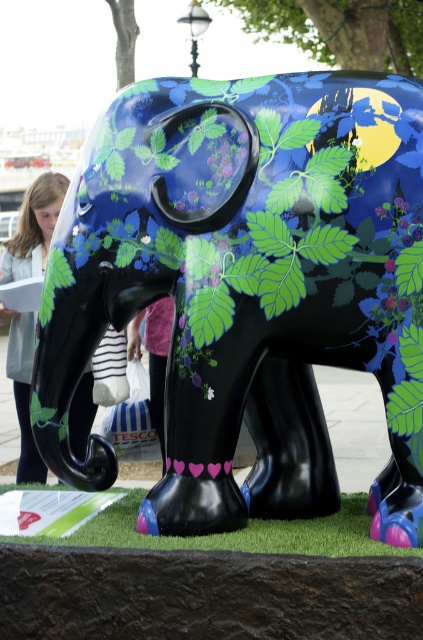
Question: Considering the relative positions of glossy painted elephant at center and blonde hair at left in the image provided, where is glossy painted elephant at center located with respect to blonde hair at left?

Choices:
 (A) left
 (B) right

Answer: (B)

Question: Among these points, which one is nearest to the camera?

Choices:
 (A) (21, 464)
 (B) (387, 508)

Answer: (B)

Question: Can you confirm if glossy painted elephant at center is positioned to the right of blonde hair at left?

Choices:
 (A) yes
 (B) no

Answer: (A)

Question: Can you confirm if glossy painted elephant at center is wider than blonde hair at left?

Choices:
 (A) yes
 (B) no

Answer: (A)

Question: Which point appears farthest from the camera in this image?

Choices:
 (A) (27, 236)
 (B) (379, 120)

Answer: (A)